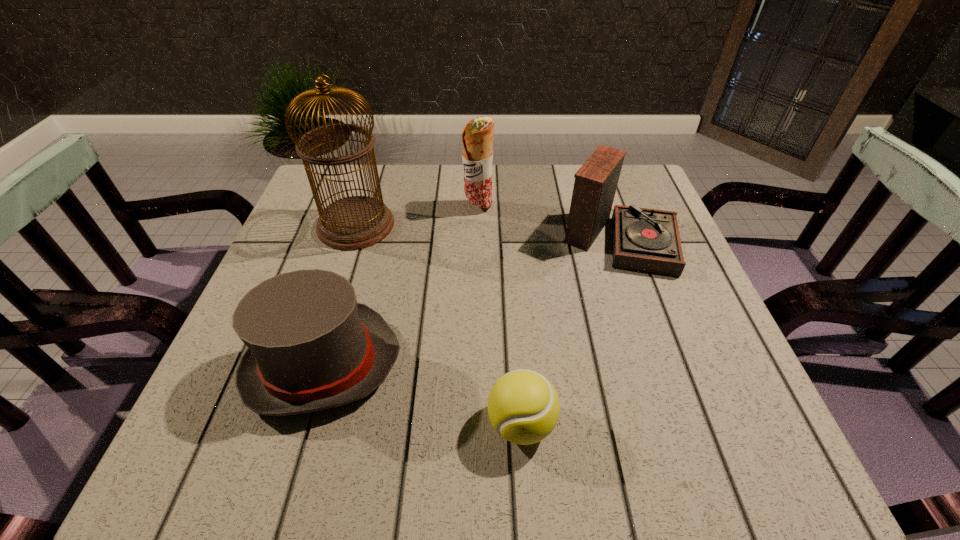
Locate an element on the screen. This screenshot has width=960, height=540. vacant area in the image that satisfies the following two spatial constraints: 1. on the front-facing side of the rightmost object; 2. on the left side of the tallest object is located at coordinates (352, 237).

The image size is (960, 540). I want to click on vacant space that satisfies the following two spatial constraints: 1. on the front-facing side of the birdcage; 2. on the right side of the phonograph record, so click(352, 237).